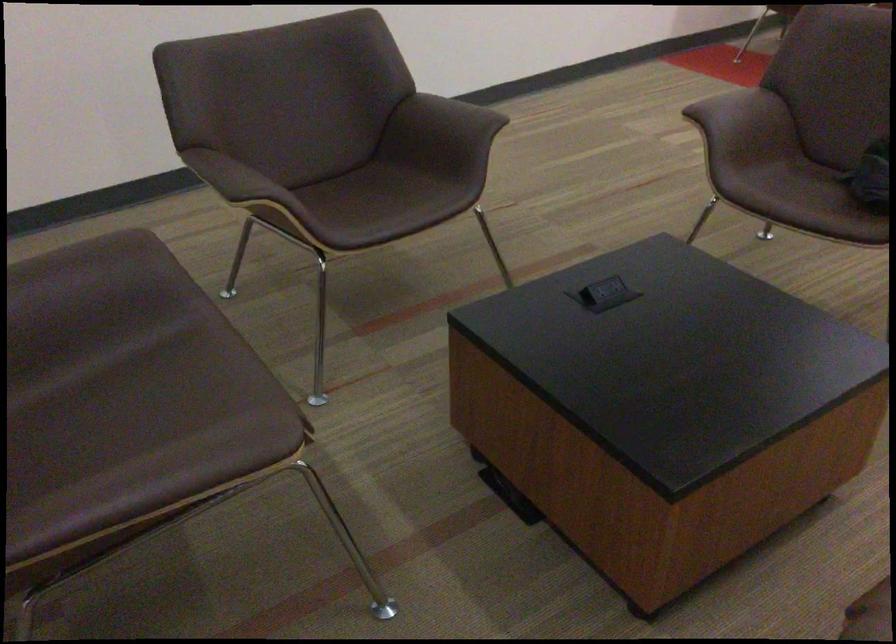
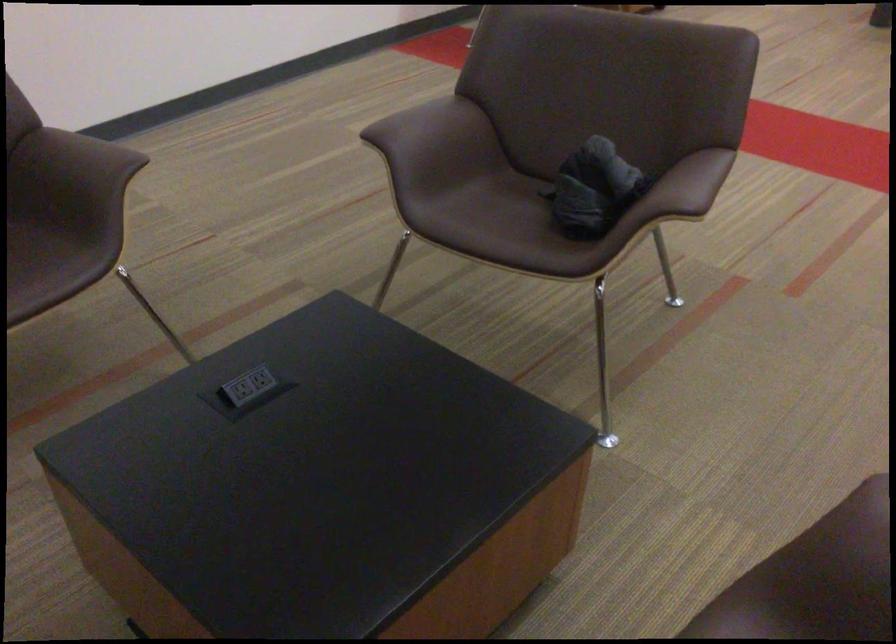
The images are taken continuously from a first-person perspective. In which direction are you moving?

The movement direction of the cameraman is right, forward.